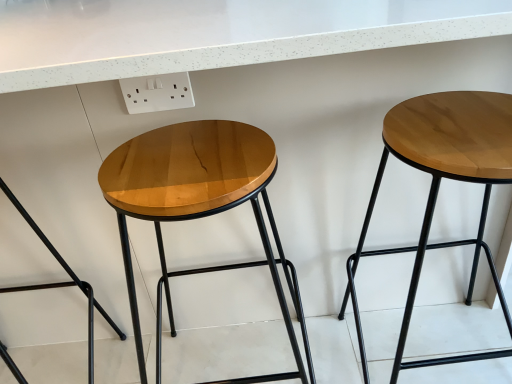
Question: Is wooden stool at right, arranged as the first stool when viewed from the right, smaller than wooden/marbled stool at left, positioned as the 3th stool in right-to-left order?

Choices:
 (A) no
 (B) yes

Answer: (A)

Question: From the image's perspective, is wooden stool at right, arranged as the first stool when viewed from the right, below wooden/marbled stool at left, positioned as the 3th stool in right-to-left order?

Choices:
 (A) no
 (B) yes

Answer: (A)

Question: Is wooden stool at right, arranged as the first stool when viewed from the right, facing away from wooden/marbled stool at left, positioned as the 3th stool in right-to-left order?

Choices:
 (A) yes
 (B) no

Answer: (B)

Question: Is wooden stool at right, the third stool in the left-to-right sequence, bigger than wooden/marbled stool at left, which appears as the 1th stool when viewed from the left?

Choices:
 (A) no
 (B) yes

Answer: (B)

Question: From the image's perspective, is wooden stool at right, the third stool in the left-to-right sequence, on top of wooden/marbled stool at left, which appears as the 1th stool when viewed from the left?

Choices:
 (A) yes
 (B) no

Answer: (A)

Question: From a real-world perspective, is wooden stool at right, the third stool in the left-to-right sequence, positioned above or below wooden stool at center, which is the second stool from right to left?

Choices:
 (A) below
 (B) above

Answer: (A)

Question: Based on their positions, is wooden stool at right, arranged as the first stool when viewed from the right, located to the left or right of wooden stool at center, which is the second stool from right to left?

Choices:
 (A) right
 (B) left

Answer: (A)

Question: Is point (437, 178) positioned closer to the camera than point (192, 213)?

Choices:
 (A) farther
 (B) closer

Answer: (A)

Question: From the image's perspective, is wooden stool at right, the third stool in the left-to-right sequence, located above or below wooden stool at center, which is the second stool from left to right?

Choices:
 (A) below
 (B) above

Answer: (B)

Question: Does point (394, 150) appear closer or farther from the camera than point (23, 288)?

Choices:
 (A) farther
 (B) closer

Answer: (B)

Question: Considering their positions, is wooden stool at right, the third stool in the left-to-right sequence, located in front of or behind wooden/marbled stool at left, which appears as the 1th stool when viewed from the left?

Choices:
 (A) front
 (B) behind

Answer: (A)

Question: Would you say wooden stool at right, arranged as the first stool when viewed from the right, is inside or outside wooden/marbled stool at left, which appears as the 1th stool when viewed from the left?

Choices:
 (A) outside
 (B) inside

Answer: (A)

Question: Visually, is wooden stool at right, the third stool in the left-to-right sequence, positioned to the left or to the right of wooden/marbled stool at left, positioned as the 3th stool in right-to-left order?

Choices:
 (A) right
 (B) left

Answer: (A)

Question: From a real-world perspective, is white plastic outlet at upper center above or below wooden stool at center, which is the second stool from right to left?

Choices:
 (A) below
 (B) above

Answer: (B)

Question: Is white plastic outlet at upper center inside or outside of wooden stool at center, which is the second stool from right to left?

Choices:
 (A) inside
 (B) outside

Answer: (B)